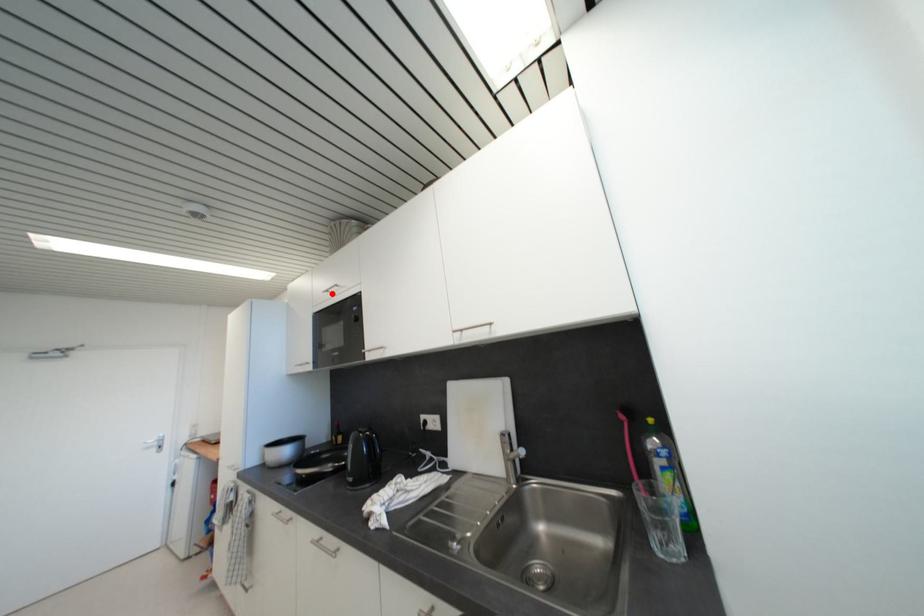
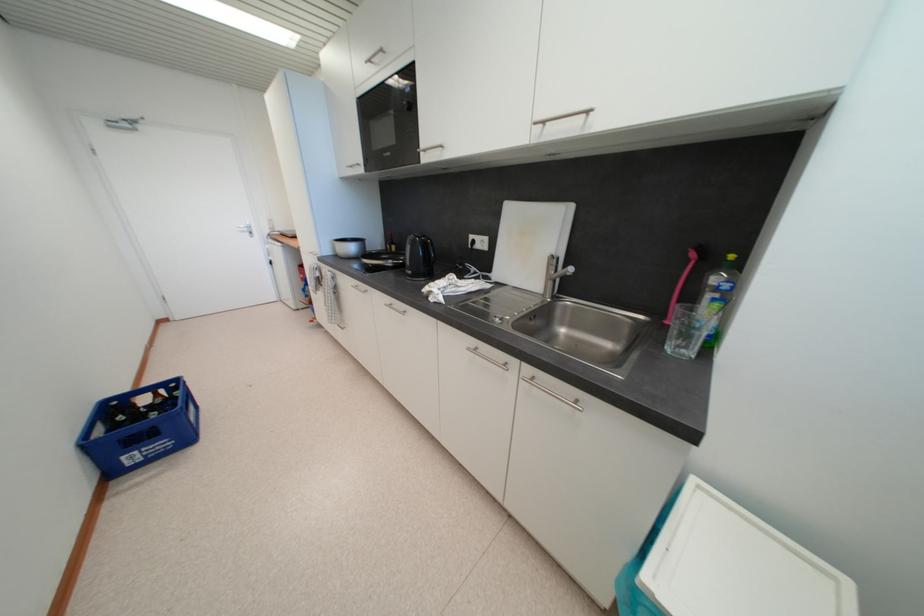
Find the pixel in the second image that matches the highlighted location in the first image.

(375, 63)